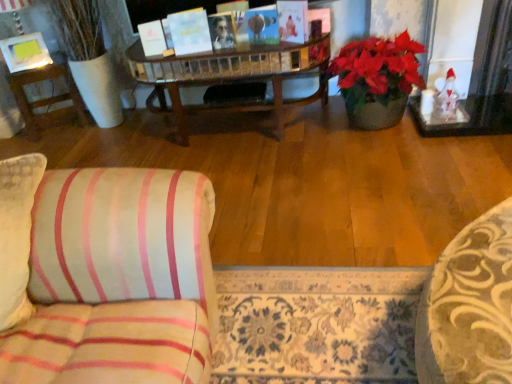
Question: Is wooden side table at left far from matte yellow picture frame at upper left?

Choices:
 (A) no
 (B) yes

Answer: (A)

Question: Is matte yellow picture frame at upper left inside wooden side table at left?

Choices:
 (A) yes
 (B) no

Answer: (B)

Question: Is wooden side table at left oriented away from matte yellow picture frame at upper left?

Choices:
 (A) no
 (B) yes

Answer: (A)

Question: From the image's perspective, is wooden side table at left below matte yellow picture frame at upper left?

Choices:
 (A) no
 (B) yes

Answer: (B)

Question: Does wooden side table at left have a larger size compared to matte yellow picture frame at upper left?

Choices:
 (A) yes
 (B) no

Answer: (A)

Question: From the image's perspective, would you say wooden side table at left is positioned over matte yellow picture frame at upper left?

Choices:
 (A) yes
 (B) no

Answer: (B)

Question: Does matte yellow picture frame at upper left have a smaller size compared to wooden side table at left?

Choices:
 (A) yes
 (B) no

Answer: (A)

Question: Is matte yellow picture frame at upper left located outside wooden side table at left?

Choices:
 (A) yes
 (B) no

Answer: (A)

Question: Is matte yellow picture frame at upper left taller than wooden side table at left?

Choices:
 (A) no
 (B) yes

Answer: (A)

Question: From the image's perspective, would you say matte yellow picture frame at upper left is shown under wooden side table at left?

Choices:
 (A) yes
 (B) no

Answer: (B)

Question: From the image's perspective, is matte yellow picture frame at upper left over wooden side table at left?

Choices:
 (A) yes
 (B) no

Answer: (A)

Question: From a real-world perspective, is matte yellow picture frame at upper left on top of wooden side table at left?

Choices:
 (A) yes
 (B) no

Answer: (A)

Question: Is matte yellow picture frame at upper left to the left or to the right of wooden side table at left in the image?

Choices:
 (A) right
 (B) left

Answer: (B)